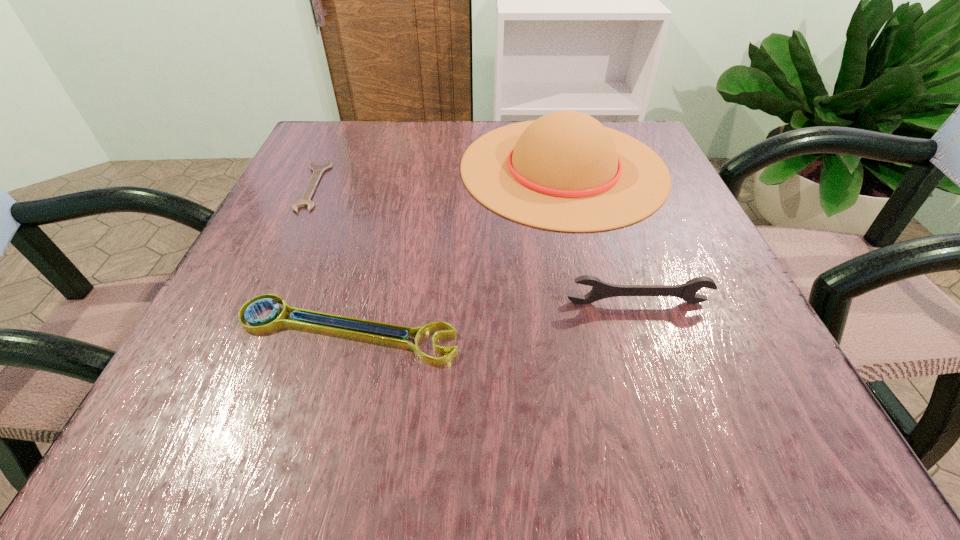
Locate an element on the screen. The image size is (960, 540). sombrero situated at the far edge is located at coordinates (566, 172).

You are a GUI agent. You are given a task and a screenshot of the screen. Output one action in this format:
    pyautogui.click(x=<x>, y=<y>)
    Task: Click on the wrench that is at the far edge
    This screenshot has width=960, height=540.
    Given the screenshot: What is the action you would take?
    pyautogui.click(x=305, y=201)

You are a GUI agent. You are given a task and a screenshot of the screen. Output one action in this format:
    pyautogui.click(x=<x>, y=<y>)
    Task: Click on the sombrero that is at the right edge
    This screenshot has height=540, width=960.
    Given the screenshot: What is the action you would take?
    pyautogui.click(x=566, y=172)

This screenshot has height=540, width=960. What are the coordinates of `wrench that is positioned at the right edge` in the screenshot? It's located at (600, 290).

Find the location of `object present at the far left corner`. object present at the far left corner is located at coordinates (305, 201).

You are a GUI agent. You are given a task and a screenshot of the screen. Output one action in this format:
    pyautogui.click(x=<x>, y=<y>)
    Task: Click on the object located in the far right corner section of the desktop
    This screenshot has width=960, height=540.
    Given the screenshot: What is the action you would take?
    pyautogui.click(x=566, y=172)

Where is `vacant space at the near edge`? This screenshot has width=960, height=540. vacant space at the near edge is located at coordinates (324, 426).

Locate an element on the screen. The height and width of the screenshot is (540, 960). free space at the right edge is located at coordinates (668, 240).

This screenshot has width=960, height=540. I want to click on blank space at the far left corner, so click(x=330, y=161).

Where is `vacant space at the near right corner`? The height and width of the screenshot is (540, 960). vacant space at the near right corner is located at coordinates (770, 392).